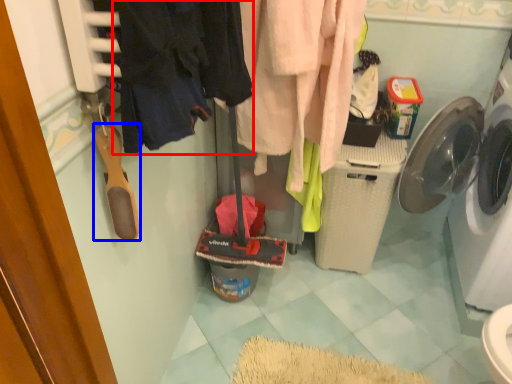
Question: Which object is closer to the camera taking this photo, clothing (highlighted by a red box) or shoe (highlighted by a blue box)?

Choices:
 (A) clothing
 (B) shoe

Answer: (A)